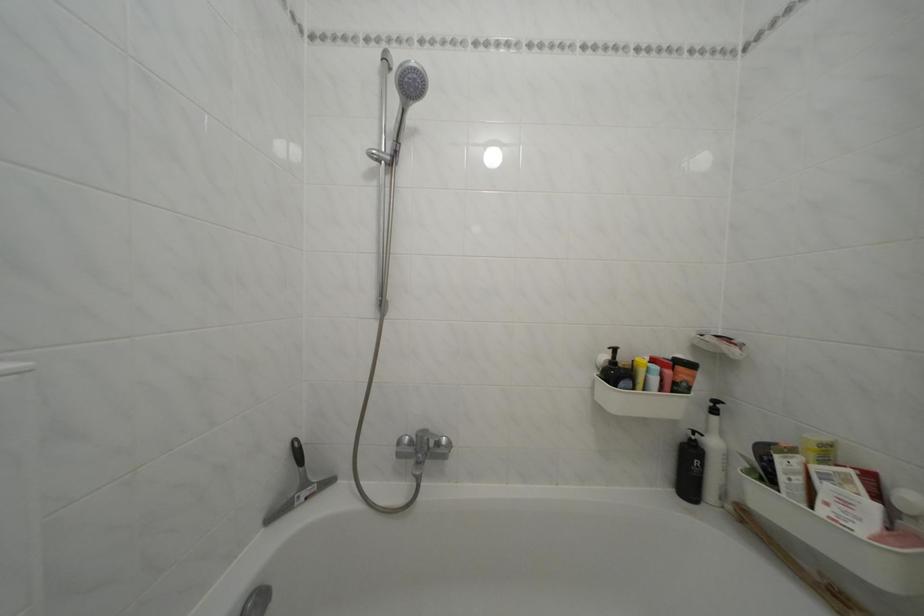
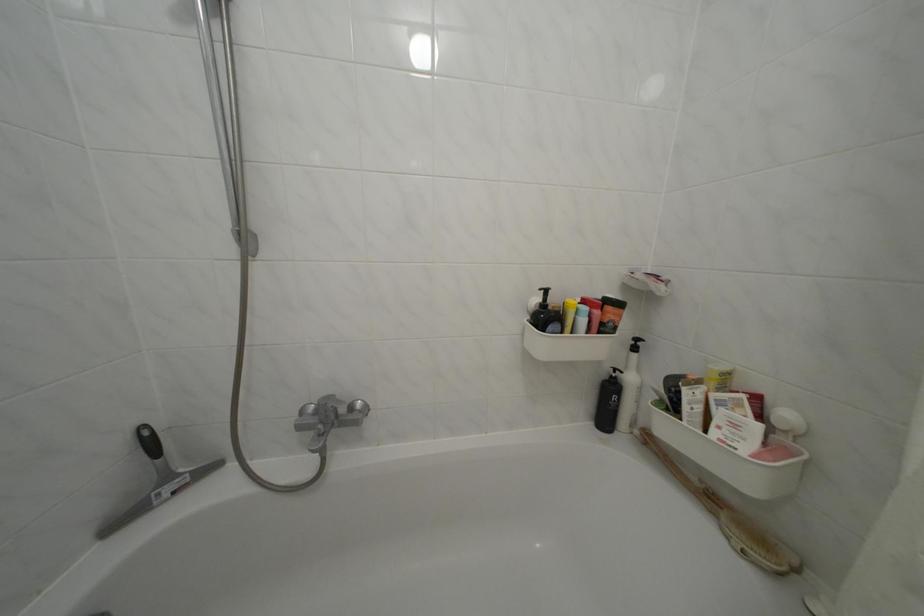
In the second image, find the point that corresponds to [629,371] in the first image.

(560, 314)